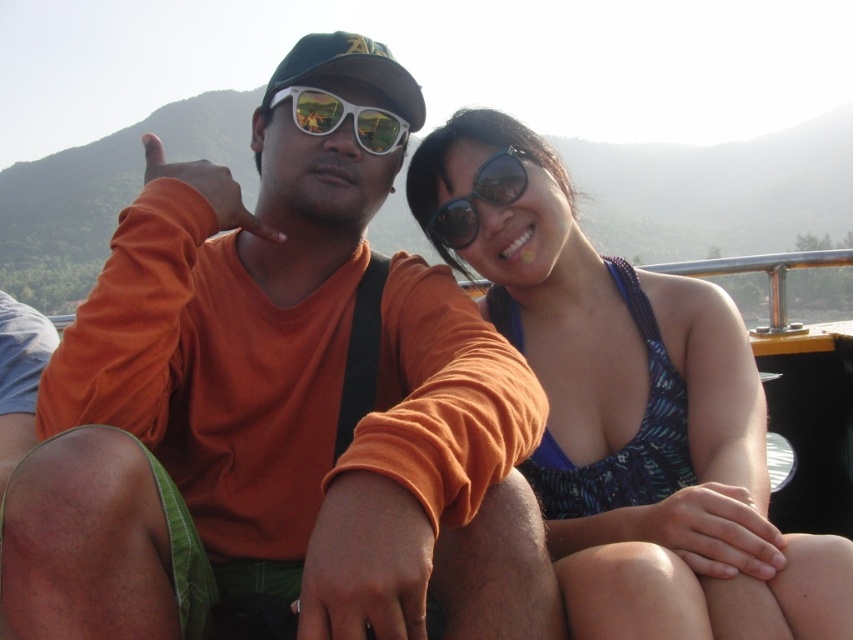
Question: Which of the following is the farthest from the observer?

Choices:
 (A) (363, 481)
 (B) (490, 166)
 (C) (320, 113)
 (D) (543, 461)

Answer: (B)

Question: Does orange matte shirt at center appear on the left side of blue textured swimsuit at center?

Choices:
 (A) no
 (B) yes

Answer: (B)

Question: Is orange matte shirt at center further to camera compared to white glossy sunglasses at center?

Choices:
 (A) no
 (B) yes

Answer: (A)

Question: Which object appears farthest from the camera in this image?

Choices:
 (A) orange matte shirt at center
 (B) sunglasses at center
 (C) blue textured swimsuit at center

Answer: (B)

Question: Which is farther from the orange matte shirt at center?

Choices:
 (A) white glossy sunglasses at center
 (B) sunglasses at center
 (C) blue textured swimsuit at center

Answer: (B)

Question: In this image, where is orange matte shirt at center located relative to white glossy sunglasses at center?

Choices:
 (A) left
 (B) right

Answer: (A)